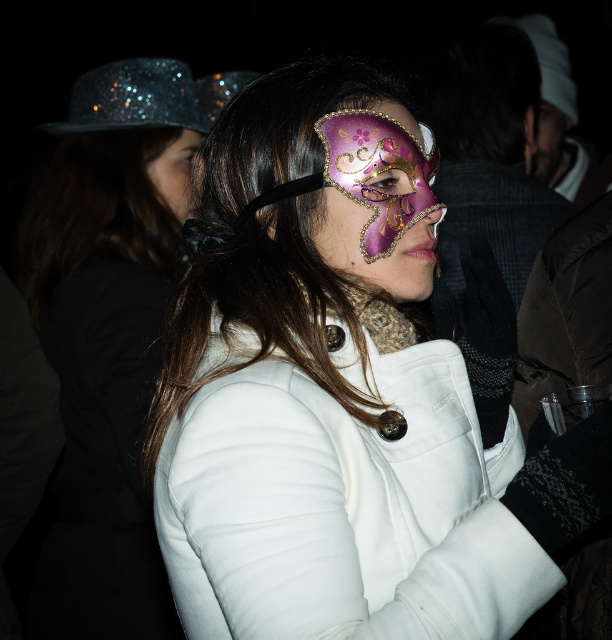
You are a photographer at the event and want to capture a closeup shot of both the matte white coat at center and the purple glossy mask at center in one frame. Given that your camera has a minimum focus distance of 3 feet, will you be able to achieve this?

The matte white coat at center and purple glossy mask at center are 3.30 feet apart from each other. Since the minimum focus distance is 3 feet, the camera can focus on both objects as they are within the required distance.

You are an event photographer at the masquerade ball. You need to capture a closeup shot of the purple glossy mask at center. Based on its position, what are the coordinates you should aim your camera at?

The purple glossy mask at center is located at coordinates point [378,198], so you should aim your camera at that point to capture the closeup shot.

You are at a masquerade party and notice two masks in the scene. One is the matte purple mask at center and the other is the matte black face at upper right. Which mask is closer to you?

The matte purple mask at center is closer to you because it is in front of the matte black face at upper right.